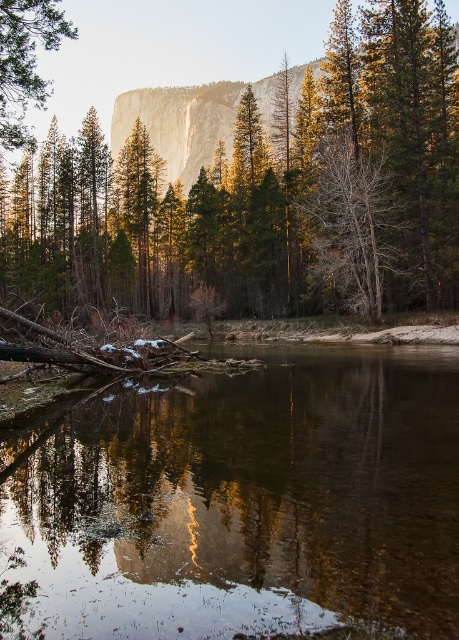
You are standing at the edge of the scene and want to reach the clear water at center. According to the coordinates provided, in which direction should you move to get there?

The clear water at center is located at coordinates point (244, 502). Since the x coordinate is 0.787, which is closer to 1, you should move to the right to reach the clear water at center.

You are an environmental scientist analyzing the health of the forest. You observe the bare wood tree at center and the green matte tree at upper left. Which tree might indicate a potential issue with the forest ecosystem, and why?

The bare wood tree at center might indicate a potential issue with the forest ecosystem because it has a greater height compared to the green matte tree at upper left, suggesting possible competition for resources or disease affecting its growth.